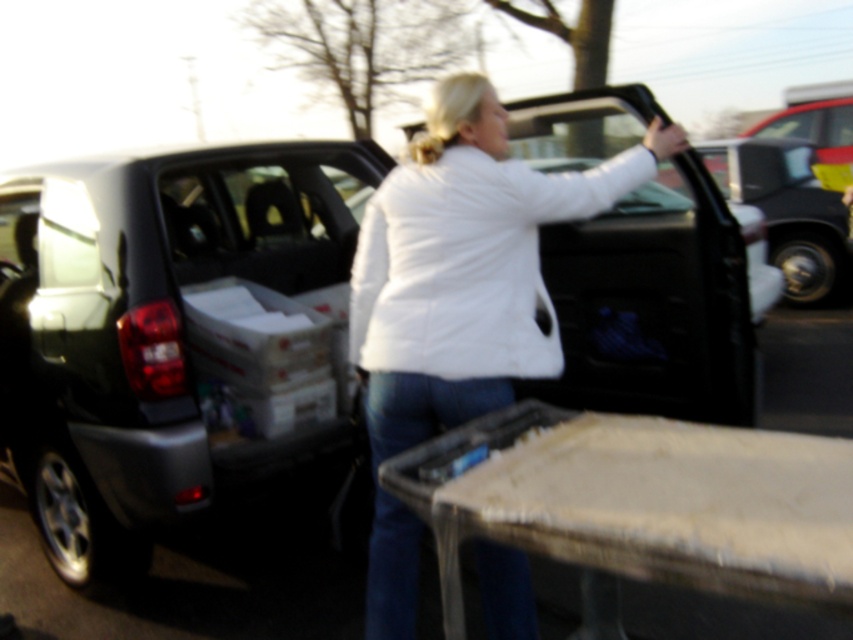
Is metallic gray car at center thinner than white puffy jacket at center?

No, metallic gray car at center is not thinner than white puffy jacket at center.

Consider the image. Who is lower down, metallic gray car at center or white puffy jacket at center?

white puffy jacket at center is below.

Who is more forward, [312,248] or [370,602]?

Point [370,602]

Identify the location of metallic gray car at center. (175, 337).